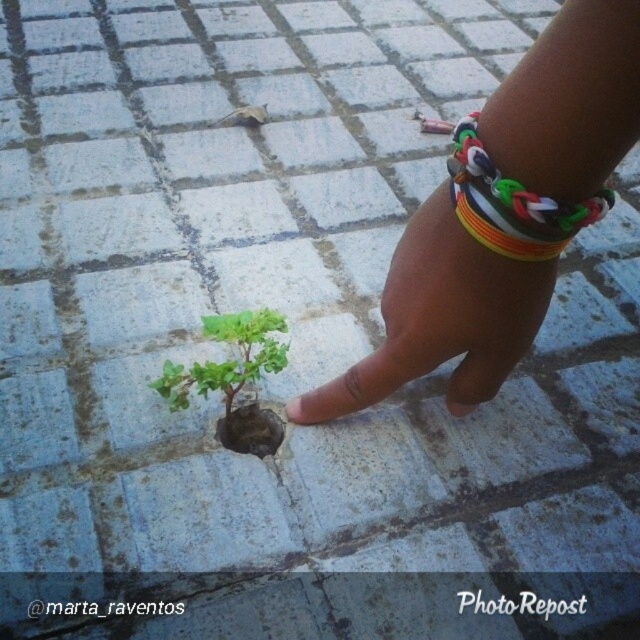
Question: Can you confirm if multicolored rubber band at center is positioned to the right of rainbow plastic bracelet at upper right?

Choices:
 (A) no
 (B) yes

Answer: (A)

Question: Which point appears closest to the camera in this image?

Choices:
 (A) (508, 230)
 (B) (237, 371)
 (C) (385, 369)
 (D) (596, 13)

Answer: (D)

Question: Which object appears closest to the camera in this image?

Choices:
 (A) multicolored rubber band at center
 (B) rainbow plastic bracelet at upper right

Answer: (B)

Question: Does rainbow rubber band at center come in front of rainbow plastic bracelet at upper right?

Choices:
 (A) no
 (B) yes

Answer: (B)

Question: Is rainbow rubber band at center bigger than green matte plant at center?

Choices:
 (A) no
 (B) yes

Answer: (B)

Question: Estimate the real-world distances between objects in this image. Which object is closer to the multicolored rubber band at center?

Choices:
 (A) rainbow rubber band at center
 (B) rainbow plastic bracelet at upper right

Answer: (A)